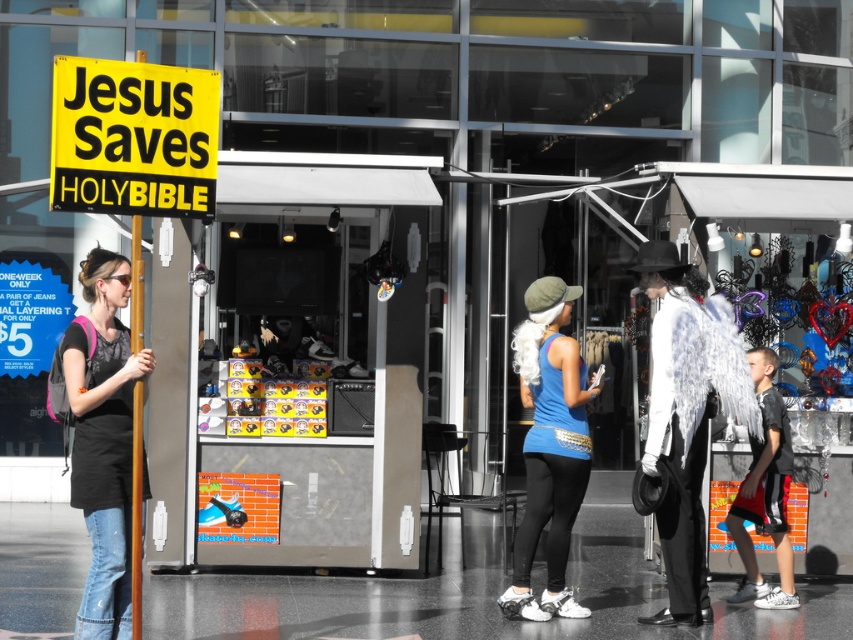
You are a photographer standing at the center of the street. You want to take a photo of the yellow paper sign at upper left and the blue fabric tank top at center. If your camera can focus on objects within 3 meters, will both objects be in focus?

The yellow paper sign at upper left is 2.93 meters from blue fabric tank top at center. Since the distance between them is within the 3 meters focus range, both objects will be in focus.

You are a pedestrian walking down the street and see the yellow paper sign at upper left and the black mesh shirt at right. Which object is positioned to the left of the other?

The yellow paper sign at upper left is to the left of the black mesh shirt at right.